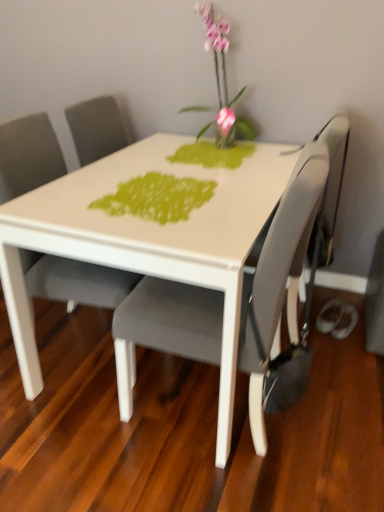
Where is `free space in front of matte gray chair at center, the 2th chair viewed from the left`? free space in front of matte gray chair at center, the 2th chair viewed from the left is located at coordinates (207, 483).